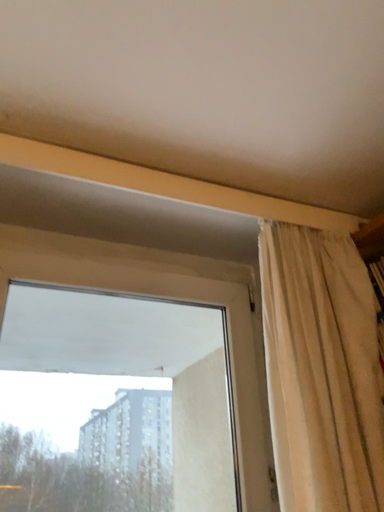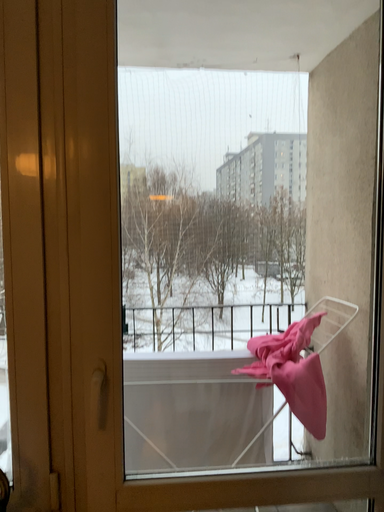
Question: How did the camera likely rotate when shooting the video?

Choices:
 (A) rotated right
 (B) rotated left

Answer: (B)